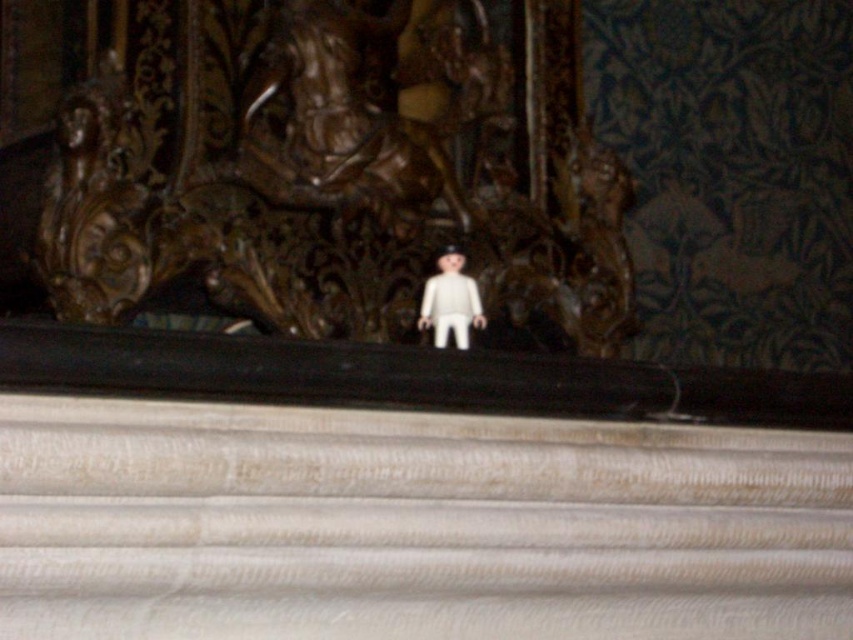
Question: Which of the following is the farthest from the observer?

Choices:
 (A) brown wood carving at center
 (B) white plastic doll at center

Answer: (A)

Question: Is brown wood carving at center closer to the viewer compared to white plastic doll at center?

Choices:
 (A) yes
 (B) no

Answer: (B)

Question: Is brown wood carving at center to the right of white plastic doll at center from the viewer's perspective?

Choices:
 (A) no
 (B) yes

Answer: (A)

Question: Which point is farther from the camera taking this photo?

Choices:
 (A) (463, 259)
 (B) (233, 305)

Answer: (B)

Question: From the image, what is the correct spatial relationship of brown wood carving at center in relation to white plastic doll at center?

Choices:
 (A) right
 (B) left

Answer: (B)